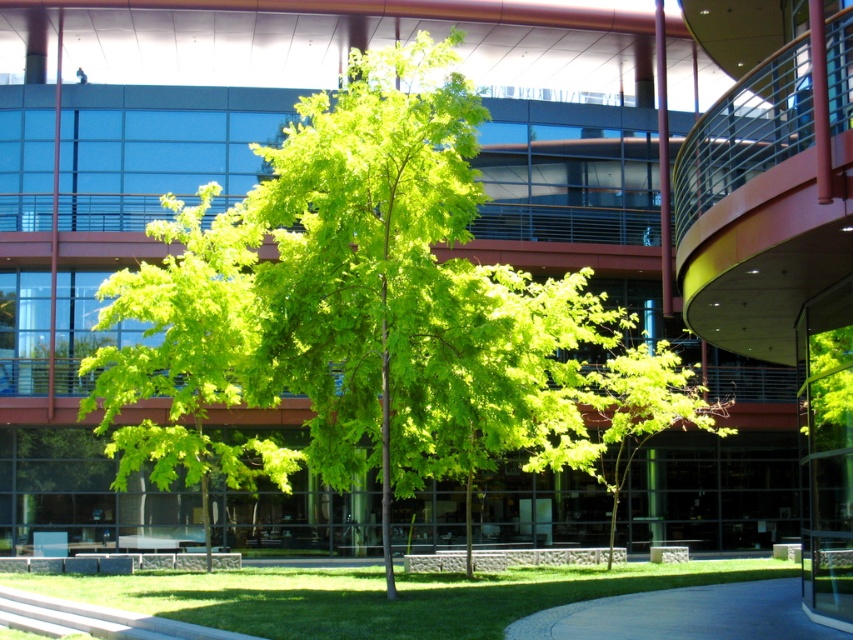
You are standing at the entrance of the building and want to walk directly to the green leafy tree at center. According to the coordinates given, in which direction should you move from your current position?

The green leafy tree at center is located at coordinates 0.556 on the x axis and 0.219 on the y axis. Since you are at the entrance, which is likely at the lower part of the image, you should move forward towards the center of the lawn to reach the tree.

You are a landscape architect designing a new pathway. You need to place a bench between the green leafy tree at center and the concrete pavement at lower center. What is the minimum length of the bench required to ensure it can be placed exactly halfway between them?

The green leafy tree at center and concrete pavement at lower center are 12.17 meters apart from each other. To place the bench exactly halfway, the minimum length needed would be 6.085 meters, which is half of the total distance between them.